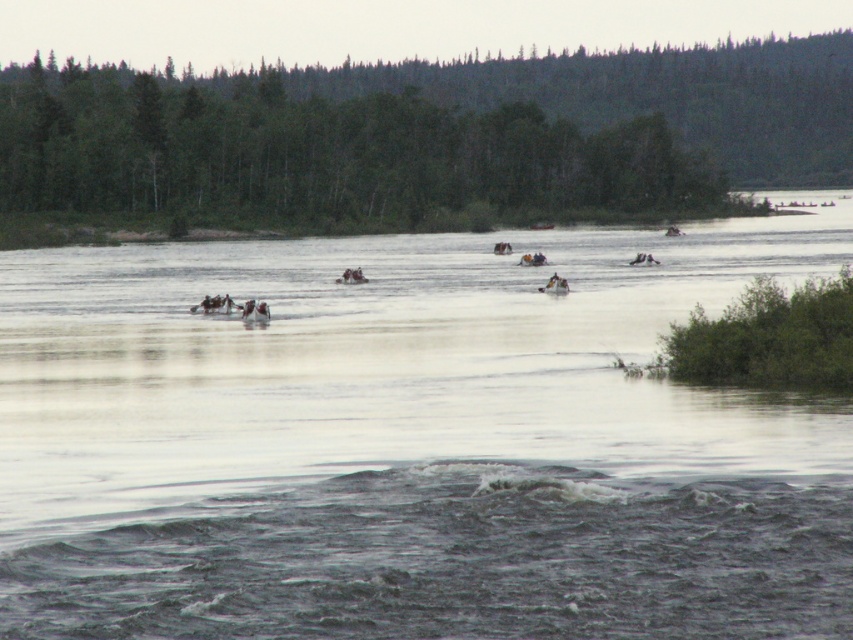
You are standing at the point with coordinates point (699, 211) and want to walk to the point with coordinates point (567, 566). Which direction should you move in?

You should move forward because point (567, 566) is in front of point (699, 211).

You are standing at the edge of the river and see two points on the water surface, namely point (177,602) and point (531,262). Which point is nearer to you?

Point (177,602) is closer to the viewer than point (531,262).

What are the coordinates of the clear water at center in the image?

The clear water at center is located at coordinates point (413,442).